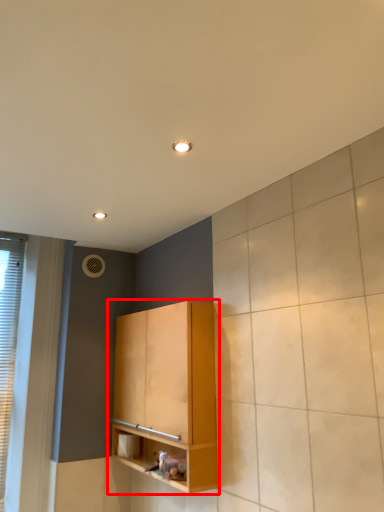
Question: From the image's perspective, what is the correct spatial relationship of cabinetry (annotated by the red box) in relation to window?

Choices:
 (A) above
 (B) below

Answer: (B)